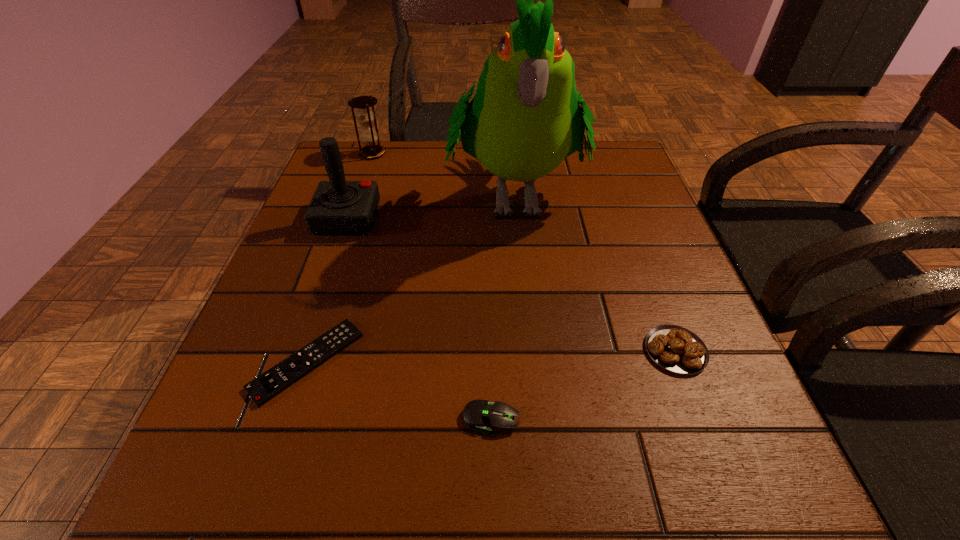
Identify the location of vacant space that satisfies the following two spatial constraints: 1. on the base of the fourth tallest object; 2. on the right side of the joystick. The image size is (960, 540). (301, 350).

You are a GUI agent. You are given a task and a screenshot of the screen. Output one action in this format:
    pyautogui.click(x=<x>, y=<y>)
    Task: Click on the free point that satisfies the following two spatial constraints: 1. on the base of the joystick; 2. on the left side of the shortest object
    The width and height of the screenshot is (960, 540).
    Given the screenshot: What is the action you would take?
    [298, 361]

Where is `free space in the image that satisfies the following two spatial constraints: 1. on the beak of the parakeet; 2. on the base of the second tallest object`? The width and height of the screenshot is (960, 540). free space in the image that satisfies the following two spatial constraints: 1. on the beak of the parakeet; 2. on the base of the second tallest object is located at coordinates (516, 219).

I want to click on free space that satisfies the following two spatial constraints: 1. on the base of the fifth shortest object; 2. on the right side of the shortest object, so click(x=298, y=361).